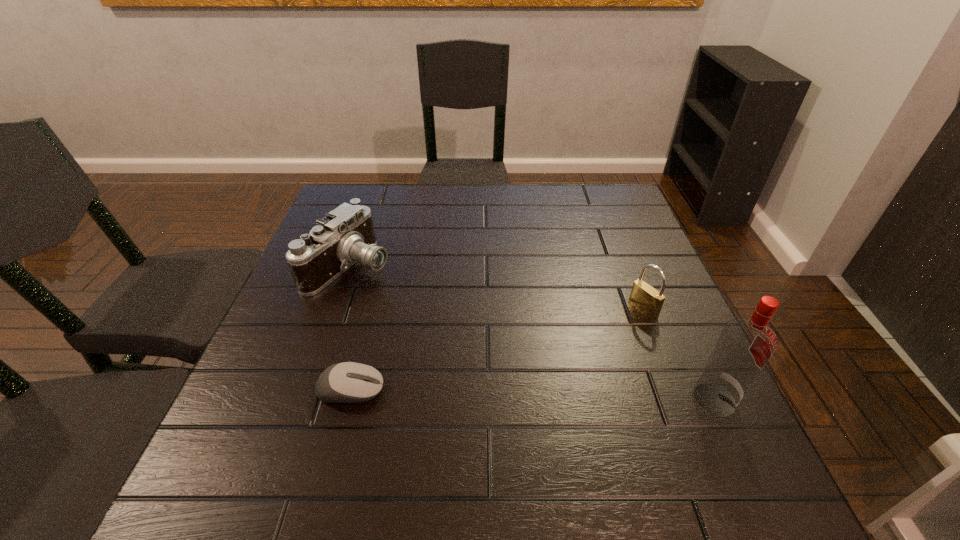
Locate an element on the screen. free space located on the front-facing side of the second farthest object is located at coordinates pyautogui.click(x=559, y=361).

This screenshot has width=960, height=540. I want to click on free space located 0.100m on the front-facing side of the second farthest object, so click(x=604, y=334).

Identify the location of free region located 0.320m on the front-facing side of the second farthest object. This screenshot has width=960, height=540. (524, 381).

This screenshot has height=540, width=960. I want to click on computer equipment present at the near edge, so click(x=349, y=382).

Find the location of a particular element. vodka that is positioned at the near edge is located at coordinates (746, 344).

Identify the location of computer equipment located in the left edge section of the desktop. (349, 382).

The height and width of the screenshot is (540, 960). Find the location of `camera present at the left edge`. camera present at the left edge is located at coordinates (346, 235).

Find the location of a particular element. vodka at the right edge is located at coordinates (746, 344).

Where is `padlock that is at the right edge`? padlock that is at the right edge is located at coordinates (646, 299).

The height and width of the screenshot is (540, 960). I want to click on object that is at the near left corner, so click(349, 382).